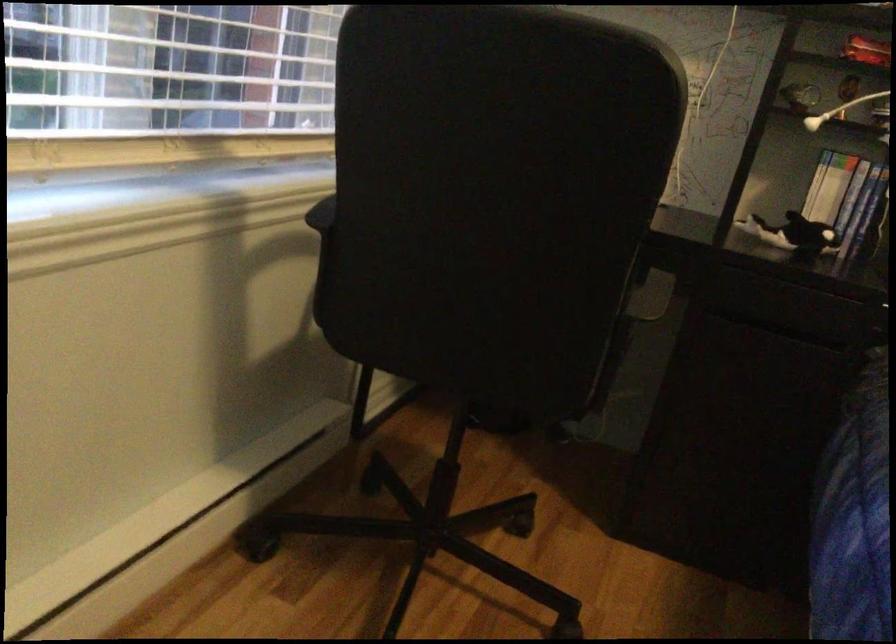
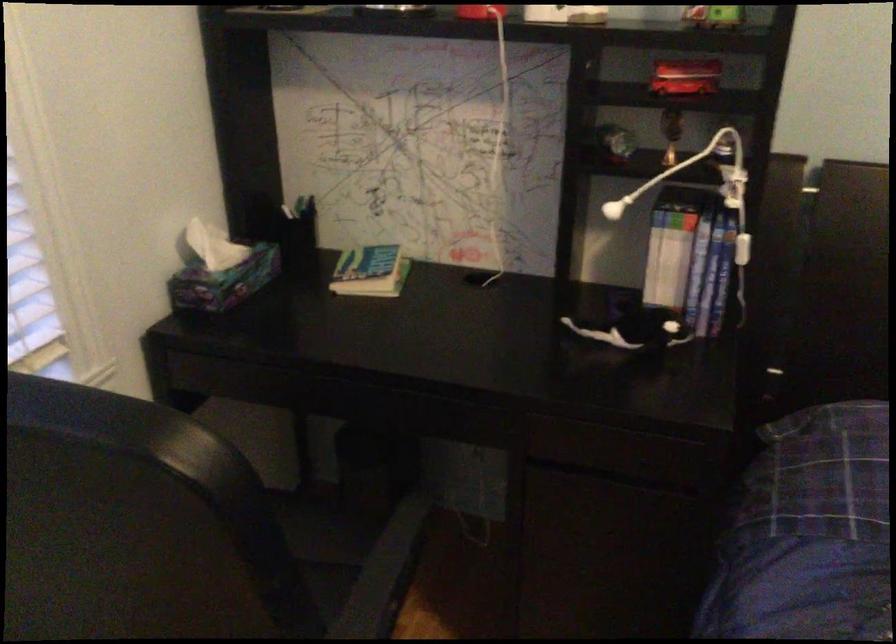
Find the pixel in the second image that matches pixel 661 111 in the first image.

(234, 509)